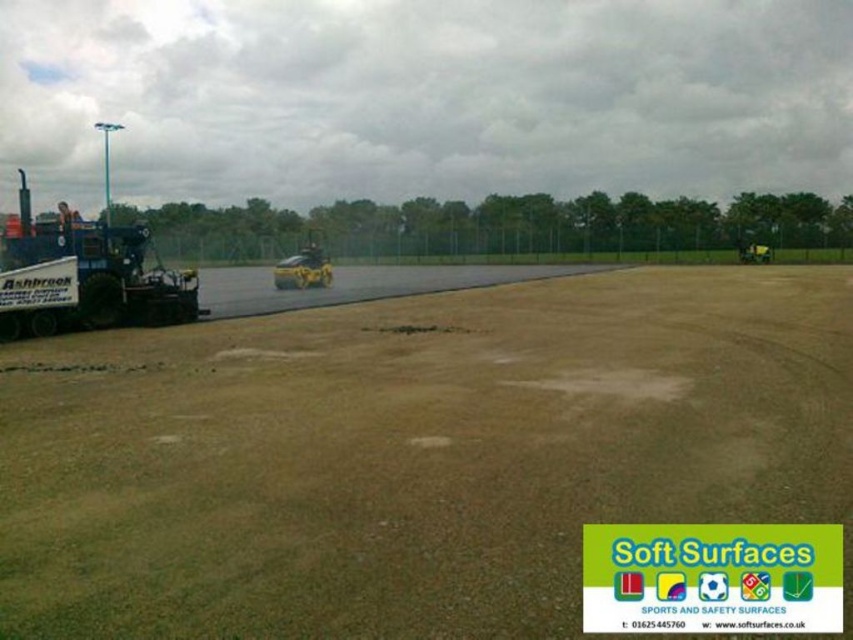
Question: Based on their relative distances, which object is nearer to the blue metallic trailer truck at left?

Choices:
 (A) yellow rubber car at center
 (B) brown sandy dirt field at center

Answer: (B)

Question: Can you confirm if brown sandy dirt field at center is bigger than yellow rubber car at center?

Choices:
 (A) yes
 (B) no

Answer: (B)

Question: Which point is closer to the camera?

Choices:
 (A) (309, 284)
 (B) (166, 468)
 (C) (9, 243)

Answer: (B)

Question: Can you confirm if blue metallic trailer truck at left is positioned above yellow rubber car at center?

Choices:
 (A) no
 (B) yes

Answer: (B)

Question: Which of these objects is positioned closest to the blue metallic trailer truck at left?

Choices:
 (A) brown sandy dirt field at center
 (B) yellow rubber car at center

Answer: (A)

Question: Can you confirm if brown sandy dirt field at center is thinner than yellow rubber car at center?

Choices:
 (A) yes
 (B) no

Answer: (B)